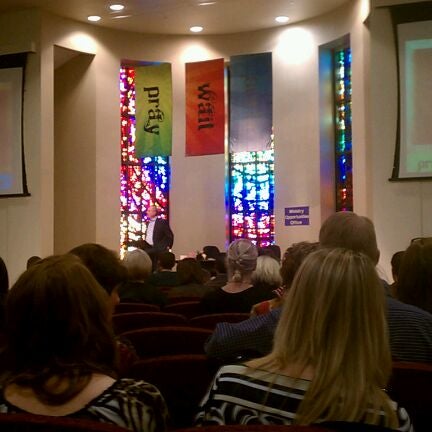
Locate an element on the screen. The image size is (432, 432). three stained glass windows is located at coordinates (347, 172), (258, 200), (150, 179).